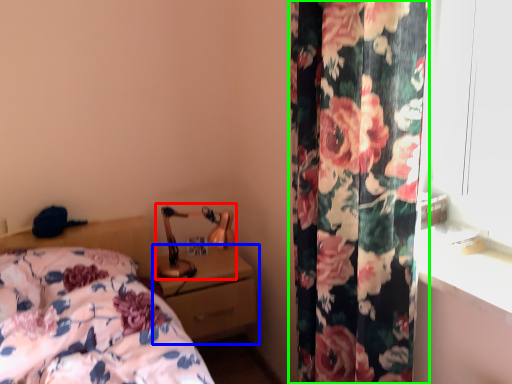
Question: Based on their relative distances, which object is farther from table lamp (highlighted by a red box)? Choose from nightstand (highlighted by a blue box) and curtain (highlighted by a green box).

Choices:
 (A) nightstand
 (B) curtain

Answer: (B)